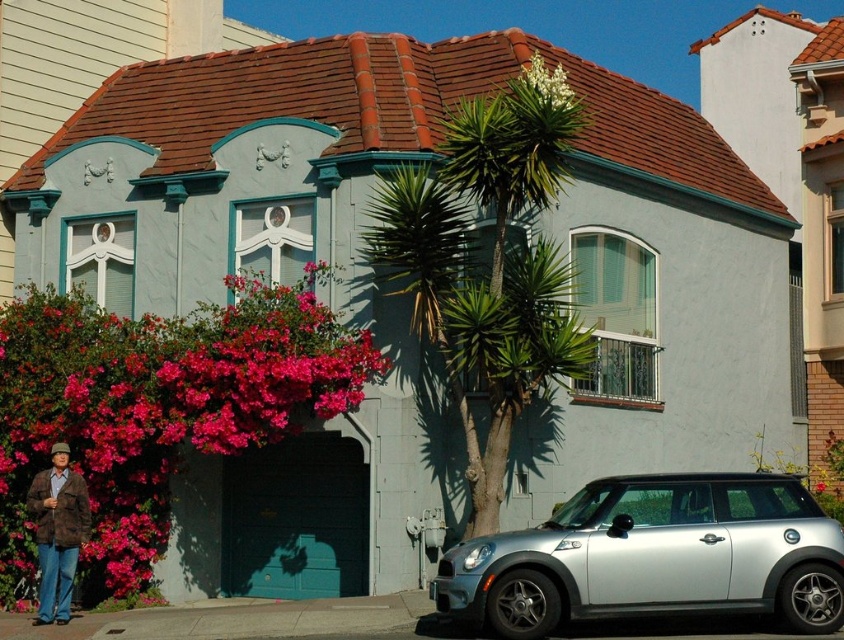
Between pink matte flowers at lower left and brown textured jacket at lower left, which one is positioned higher?

brown textured jacket at lower left

Is pink matte flowers at lower left to the left of brown textured jacket at lower left from the viewer's perspective?

Incorrect, pink matte flowers at lower left is not on the left side of brown textured jacket at lower left.

Locate an element on the screen. The height and width of the screenshot is (640, 844). pink matte flowers at lower left is located at coordinates (157, 404).

From the picture: Can you confirm if pink matte flowers at lower left is smaller than white textured plant at upper center?

Yes, pink matte flowers at lower left is smaller than white textured plant at upper center.

This screenshot has height=640, width=844. Describe the element at coordinates (157, 404) in the screenshot. I see `pink matte flowers at lower left` at that location.

Locate an element on the screen. This screenshot has height=640, width=844. pink matte flowers at lower left is located at coordinates (157, 404).

Is point (326, 365) in front of point (552, 604)?

No, (326, 365) is further to viewer.

How far apart are pink matte flowers at lower left and silver metallic car at lower right?

pink matte flowers at lower left is 31.29 feet from silver metallic car at lower right.

Locate an element on the screen. The height and width of the screenshot is (640, 844). pink matte flowers at lower left is located at coordinates (157, 404).